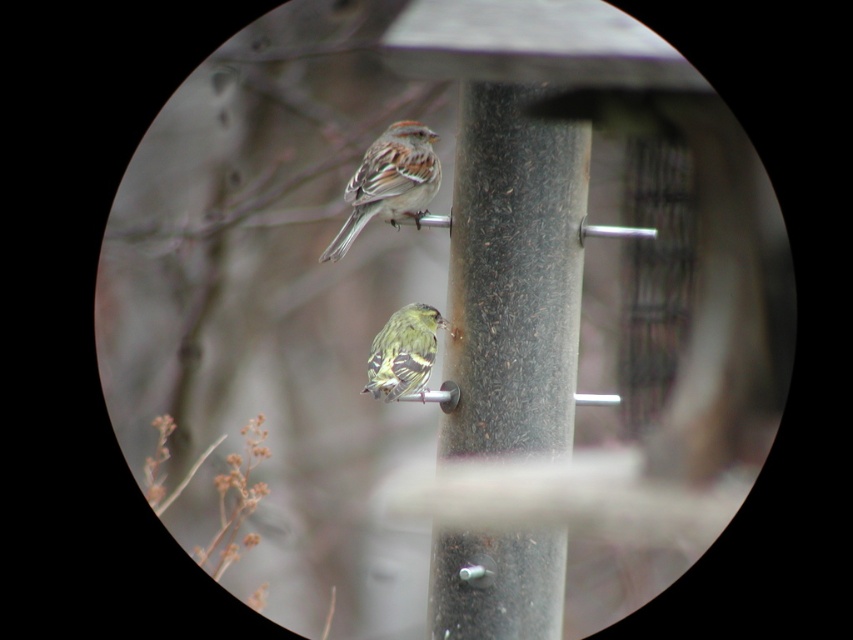
Question: Which of the following is the farthest from the observer?

Choices:
 (A) (395, 364)
 (B) (344, 236)

Answer: (B)

Question: Which object is closer to the camera taking this photo?

Choices:
 (A) yellow-green speckled sparrow at center
 (B) brown speckled feathers at upper center

Answer: (A)

Question: Is brown speckled feathers at upper center closer to the viewer compared to yellow-green speckled sparrow at center?

Choices:
 (A) no
 (B) yes

Answer: (A)

Question: Can you confirm if brown speckled feathers at upper center is smaller than yellow-green speckled sparrow at center?

Choices:
 (A) no
 (B) yes

Answer: (A)

Question: Which of the following is the farthest from the observer?

Choices:
 (A) yellow-green speckled sparrow at center
 (B) brown speckled feathers at upper center

Answer: (B)

Question: Is brown speckled feathers at upper center below yellow-green speckled sparrow at center?

Choices:
 (A) no
 (B) yes

Answer: (A)